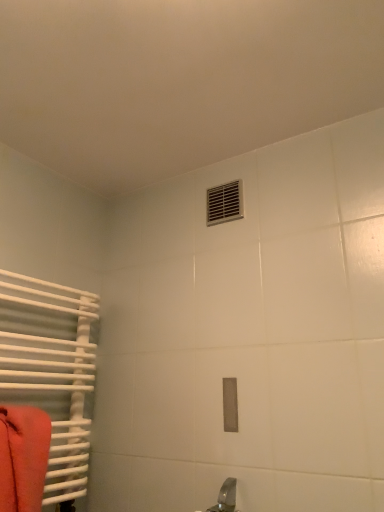
Measure the distance between point (216, 186) and camera.

Point (216, 186) is 1.51 meters from camera.

Describe the element at coordinates (225, 203) in the screenshot. I see `metallic silver vent at upper center` at that location.

Measure the distance between point (83, 445) and camera.

Point (83, 445) and camera are 1.36 meters apart.

At what (x,y) coordinates should I click in order to perform the action: click on metallic silver vent at upper center. Please return your answer as a coordinate pair (x, y). Image resolution: width=384 pixels, height=512 pixels. Looking at the image, I should click on (225, 203).

Can you confirm if white matte radiator at left is bigger than metallic silver vent at upper center?

Yes, white matte radiator at left is bigger than metallic silver vent at upper center.

Identify the location of air conditioning on the right of white matte radiator at left. This screenshot has width=384, height=512. (225, 203).

From the image's perspective, which object appears higher, white matte radiator at left or metallic silver vent at upper center?

metallic silver vent at upper center is shown above in the image.

Is white matte radiator at left oriented towards metallic silver vent at upper center?

No, white matte radiator at left is not aimed at metallic silver vent at upper center.

Considering the sizes of objects white matte radiator at left and matte orange towel at left in the image provided, who is thinner, white matte radiator at left or matte orange towel at left?

matte orange towel at left is thinner.

Are white matte radiator at left and matte orange towel at left located far from each other?

No, white matte radiator at left is not far away from matte orange towel at left.

From the image's perspective, is white matte radiator at left located above matte orange towel at left?

Correct, white matte radiator at left appears higher than matte orange towel at left in the image.

Is white matte radiator at left located outside matte orange towel at left?

Yes.

This screenshot has height=512, width=384. I want to click on radiator in front of the metallic silver vent at upper center, so click(52, 370).

Considering the relative positions of metallic silver vent at upper center and white matte radiator at left in the image provided, is metallic silver vent at upper center to the right of white matte radiator at left from the viewer's perspective?

Correct, you'll find metallic silver vent at upper center to the right of white matte radiator at left.

Who is shorter, metallic silver vent at upper center or white matte radiator at left?

With less height is metallic silver vent at upper center.

In the scene shown: Could white matte radiator at left be considered to be inside metallic silver vent at upper center?

No, white matte radiator at left is not inside metallic silver vent at upper center.

Is white matte radiator at left at the back of matte orange towel at left?

Yes, matte orange towel at left is facing away from white matte radiator at left.

Which of these two, matte orange towel at left or white matte radiator at left, stands shorter?

matte orange towel at left is shorter.

Who is more distant, matte orange towel at left or white matte radiator at left?

Positioned behind is white matte radiator at left.

From the picture: Is matte orange towel at left turned away from metallic silver vent at upper center?

No, matte orange towel at left is not facing away from metallic silver vent at upper center.

You are a GUI agent. You are given a task and a screenshot of the screen. Output one action in this format:
    pyautogui.click(x=<x>, y=<y>)
    Task: Click on the air conditioning that is above the matte orange towel at left (from a real-world perspective)
    This screenshot has width=384, height=512.
    Given the screenshot: What is the action you would take?
    [x=225, y=203]

Is metallic silver vent at upper center looking in the opposite direction of matte orange towel at left?

No, matte orange towel at left is not at the back of metallic silver vent at upper center.

Does metallic silver vent at upper center touch matte orange towel at left?

No, metallic silver vent at upper center is not with matte orange towel at left.

Can you confirm if metallic silver vent at upper center is positioned to the left of matte orange towel at left?

In fact, metallic silver vent at upper center is to the right of matte orange towel at left.

In terms of width, does metallic silver vent at upper center look wider or thinner when compared to matte orange towel at left?

Considering their sizes, metallic silver vent at upper center looks slimmer than matte orange towel at left.

In order to click on radiator below the metallic silver vent at upper center (from a real-world perspective) in this screenshot , I will do `click(52, 370)`.

The width and height of the screenshot is (384, 512). What are the coordinates of `radiator that appears above the matte orange towel at left (from the image's perspective)` in the screenshot? It's located at (52, 370).

Consider the image. Based on their spatial positions, is metallic silver vent at upper center or white matte radiator at left further from matte orange towel at left?

metallic silver vent at upper center is positioned further to the anchor matte orange towel at left.

Estimate the real-world distances between objects in this image. Which object is closer to white matte radiator at left, matte orange towel at left or metallic silver vent at upper center?

matte orange towel at left.

Based on their spatial positions, is metallic silver vent at upper center or matte orange towel at left further from white matte radiator at left?

Based on the image, metallic silver vent at upper center appears to be further to white matte radiator at left.

Estimate the real-world distances between objects in this image. Which object is further from matte orange towel at left, white matte radiator at left or metallic silver vent at upper center?

metallic silver vent at upper center.

Estimate the real-world distances between objects in this image. Which object is closer to metallic silver vent at upper center, matte orange towel at left or white matte radiator at left?

white matte radiator at left.

Looking at the image, which one is located further to metallic silver vent at upper center, white matte radiator at left or matte orange towel at left?

Based on the image, matte orange towel at left appears to be further to metallic silver vent at upper center.

Find the location of a particular element. The height and width of the screenshot is (512, 384). radiator that lies between metallic silver vent at upper center and matte orange towel at left from top to bottom is located at coordinates (52, 370).